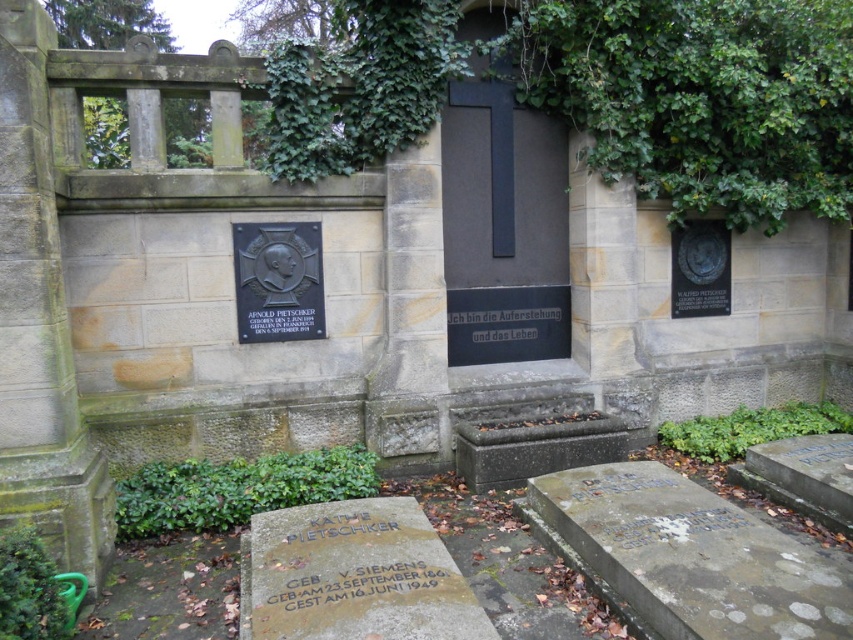
Question: Among these points, which one is farthest from the camera?

Choices:
 (A) (287, 257)
 (B) (352, 513)
 (C) (643, 540)
 (D) (360, 608)

Answer: (A)

Question: Can you confirm if white stone inscription at lower right is positioned to the left of black metal plaque at center left?

Choices:
 (A) yes
 (B) no

Answer: (B)

Question: Observing the image, what is the correct spatial positioning of polished bronze plaque at center left in reference to black metal plaque at center left?

Choices:
 (A) above
 (B) below

Answer: (A)

Question: Is matte stone inscription at center further to the viewer compared to black metal plaque at center left?

Choices:
 (A) yes
 (B) no

Answer: (B)

Question: Which point is closer to the camera?

Choices:
 (A) gold engraved stone at lower center
 (B) matte stone inscription at center
 (C) bronze plaque at center
 (D) polished bronze plaque at center left

Answer: (B)

Question: Which point is closer to the camera taking this photo?

Choices:
 (A) (297, 593)
 (B) (289, 298)
 (C) (705, 518)

Answer: (A)